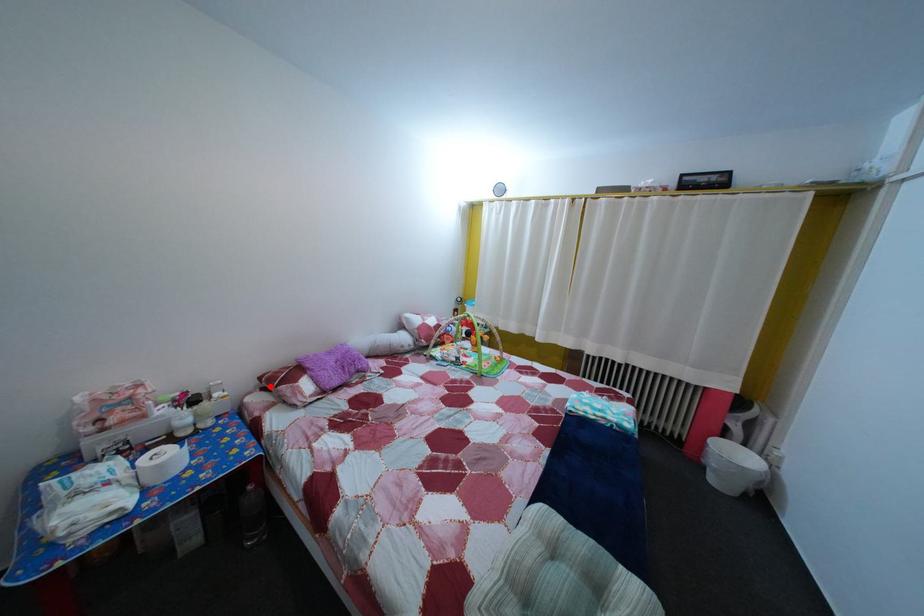
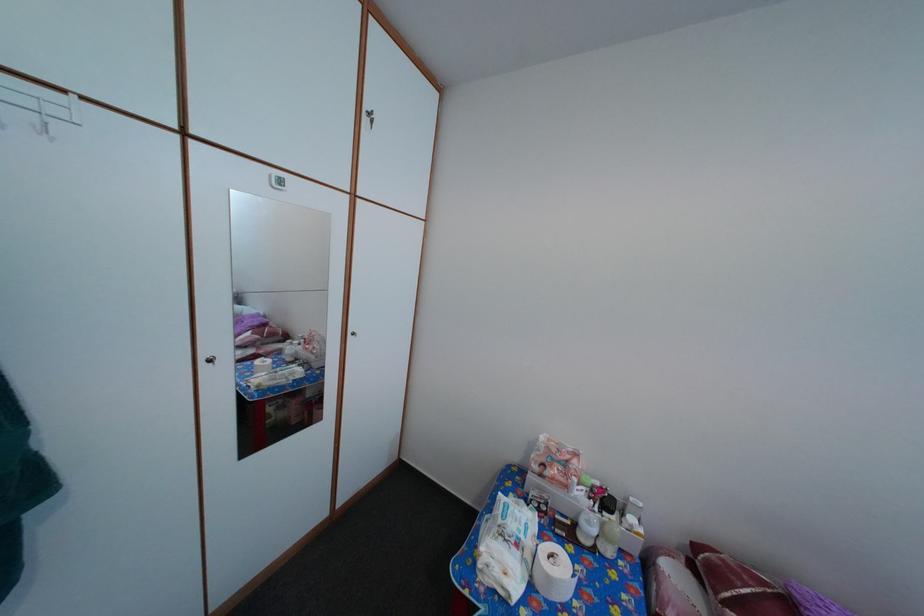
In the second image, find the point that corresponds to the highlighted location in the first image.

(704, 554)